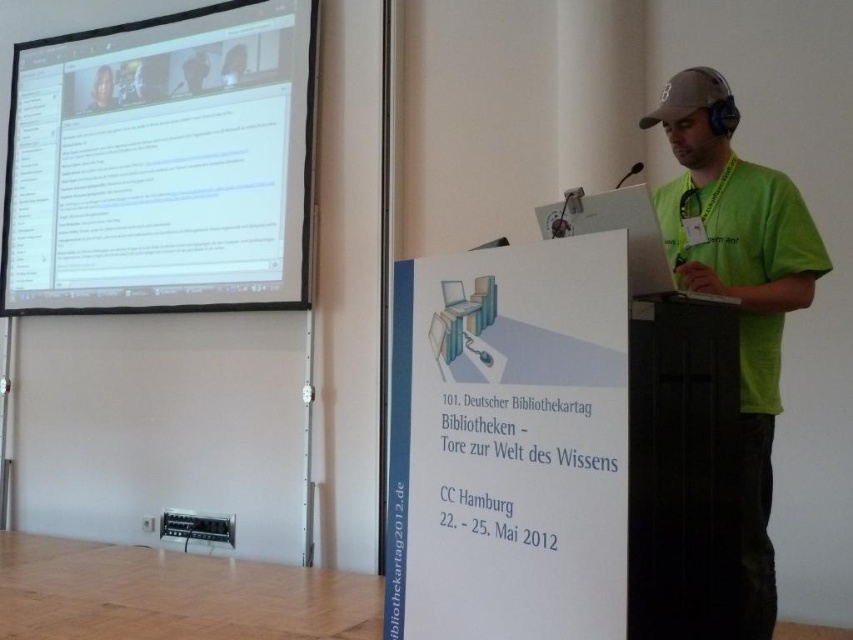
You are an attendee in the conference room and want to take a photo of the white glossy projector screen at upper left. Where should you position yourself to capture the entire screen in your camera frame?

The white glossy projector screen at upper left is located at point (163, 164), so you should position yourself directly in front of it to ensure the entire screen is within your camera frame.

You are standing in the conference room and want to determine which of the two points, point (717,202) or point (97,92), is closer to you. Based on the scene description, which point is closer?

Point (717,202) is closer to the viewer than point (97,92) according to the description.